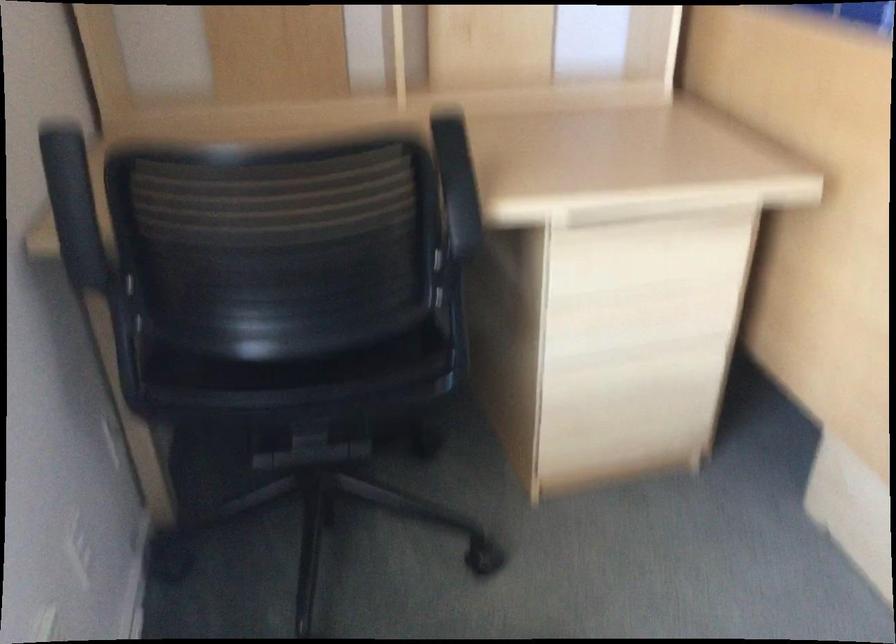
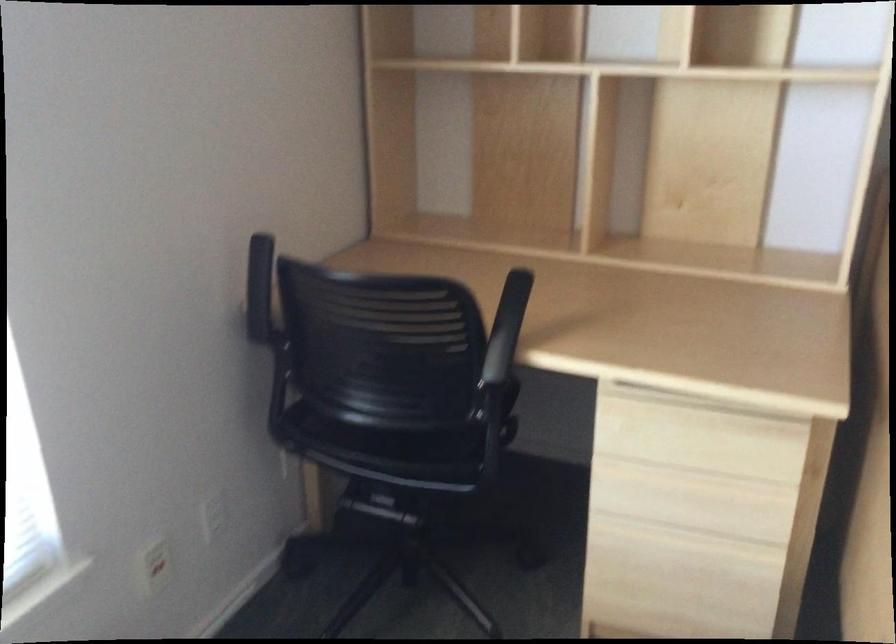
Question: The images are taken continuously from a first-person perspective. In which direction is your viewpoint rotating?

Choices:
 (A) Left
 (B) Right
 (C) Up
 (D) Down

Answer: (A)